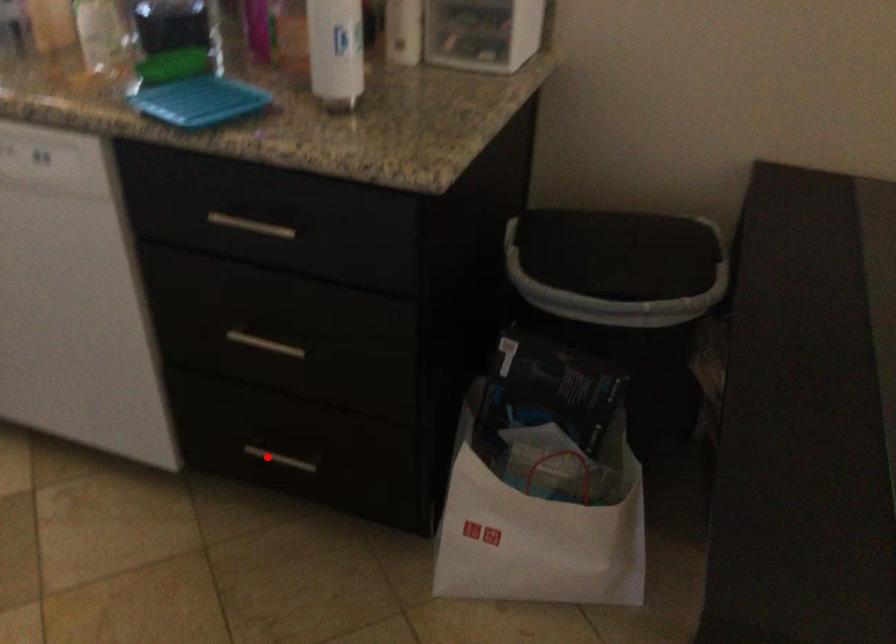
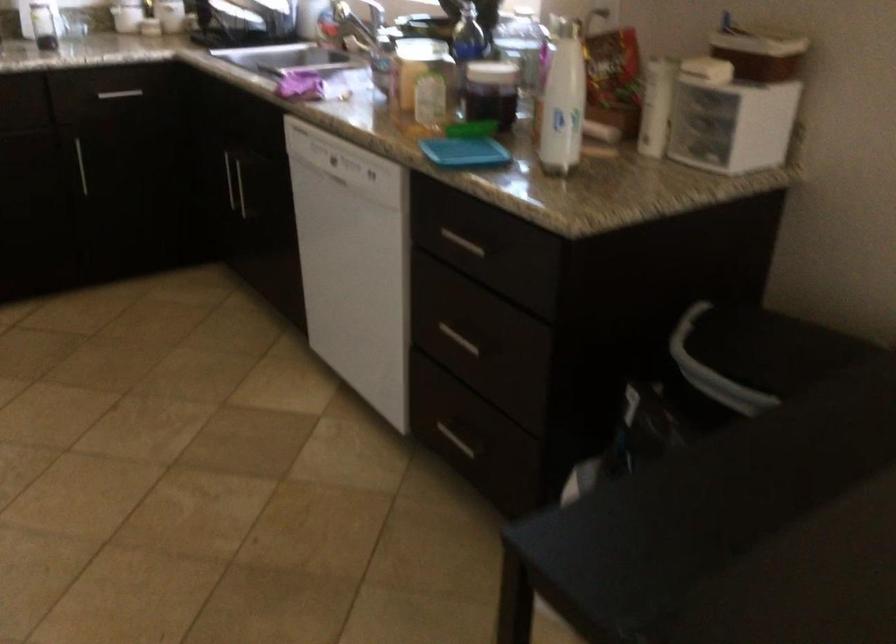
Locate, in the second image, the point that corresponds to the highlighted location in the first image.

(455, 440)